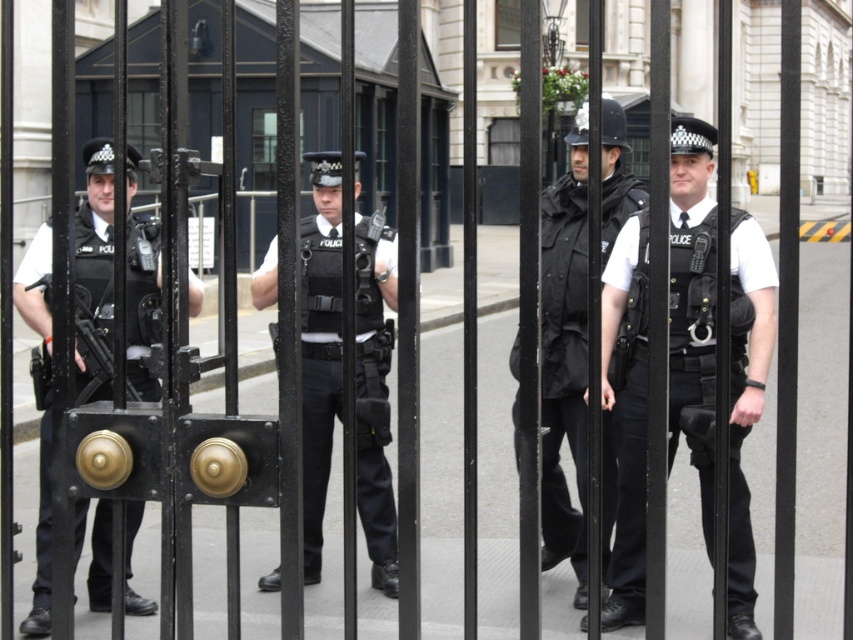
Question: Does black matte vest at center come in front of black matte uniform at center?

Choices:
 (A) no
 (B) yes

Answer: (B)

Question: Is matte black uniform at left below black matte uniform at center?

Choices:
 (A) no
 (B) yes

Answer: (A)

Question: Which point is closer to the camera?

Choices:
 (A) black matte uniform at center
 (B) white matte uniform at center
 (C) matte black uniform at left

Answer: (C)

Question: Which point is closer to the camera?

Choices:
 (A) (622, 458)
 (B) (131, 369)
 (C) (326, 330)
 (D) (560, 412)

Answer: (A)

Question: Does black matte vest at center appear on the right side of white matte uniform at center?

Choices:
 (A) yes
 (B) no

Answer: (B)

Question: Which of the following is the farthest from the observer?

Choices:
 (A) 758,394
 (B) 77,500
 (C) 607,220
 (D) 358,493

Answer: (D)